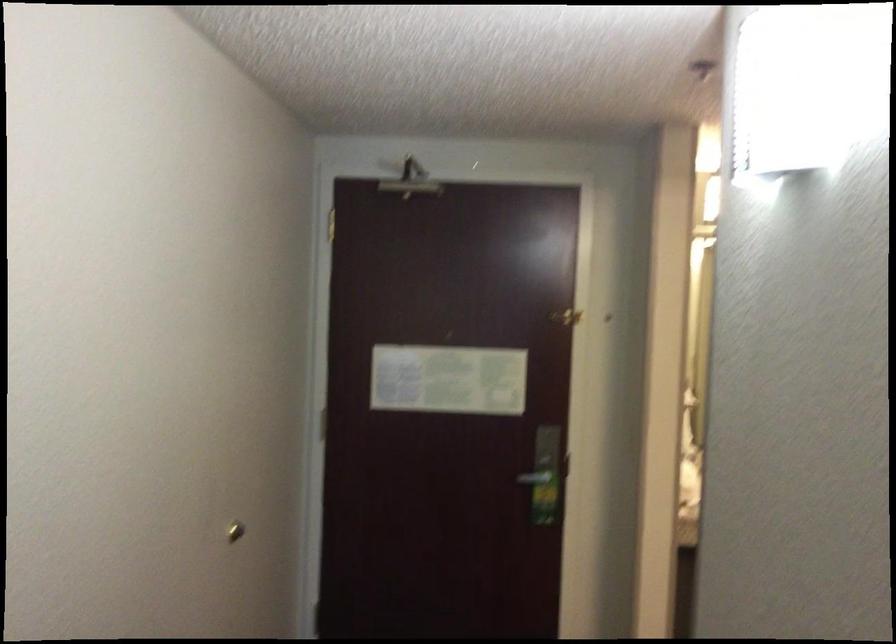
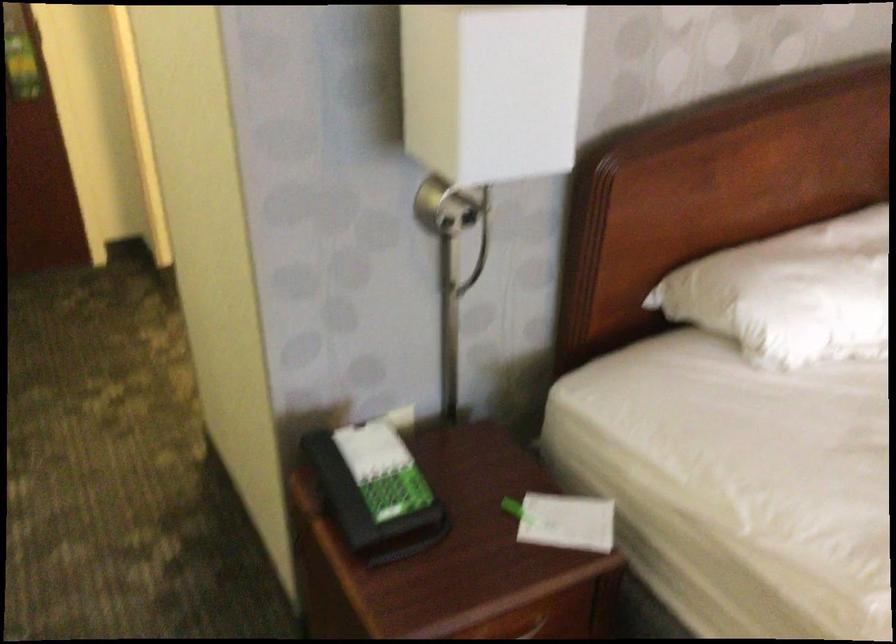
The images are taken continuously from a first-person perspective. In which direction is your viewpoint rotating?

The camera rotated toward right-down.